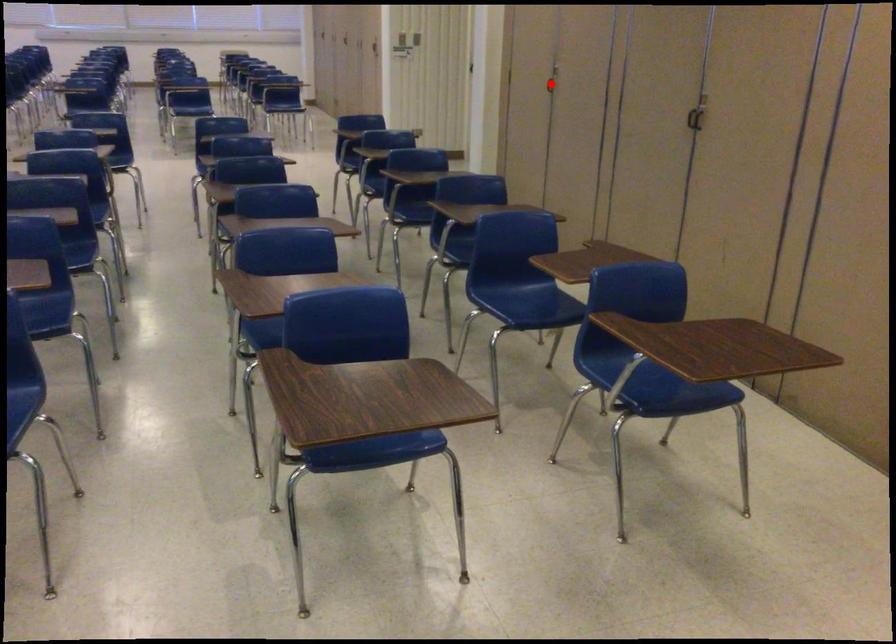
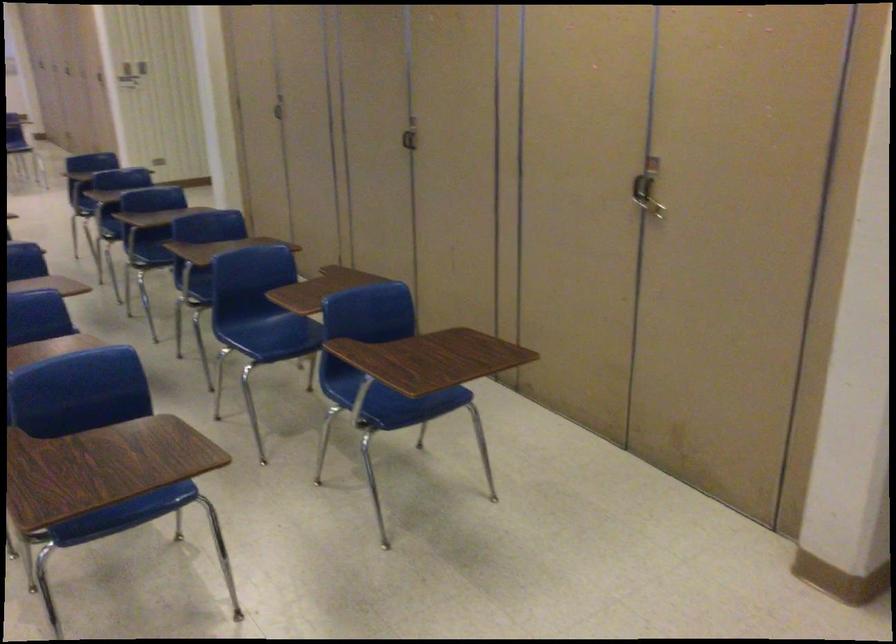
Question: I am providing you with two images of the same scene from different viewpoints. A red point is marked on the first image. Is the red point's position out of view in image 2?

Choices:
 (A) Yes
 (B) No

Answer: (B)